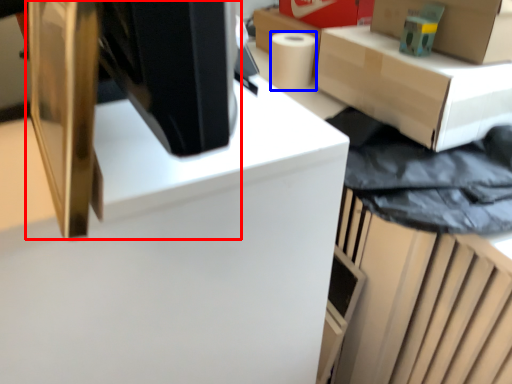
Question: Which point is closer to the camera, desktop computer (highlighted by a red box) or paper towel (highlighted by a blue box)?

Choices:
 (A) desktop computer
 (B) paper towel

Answer: (A)